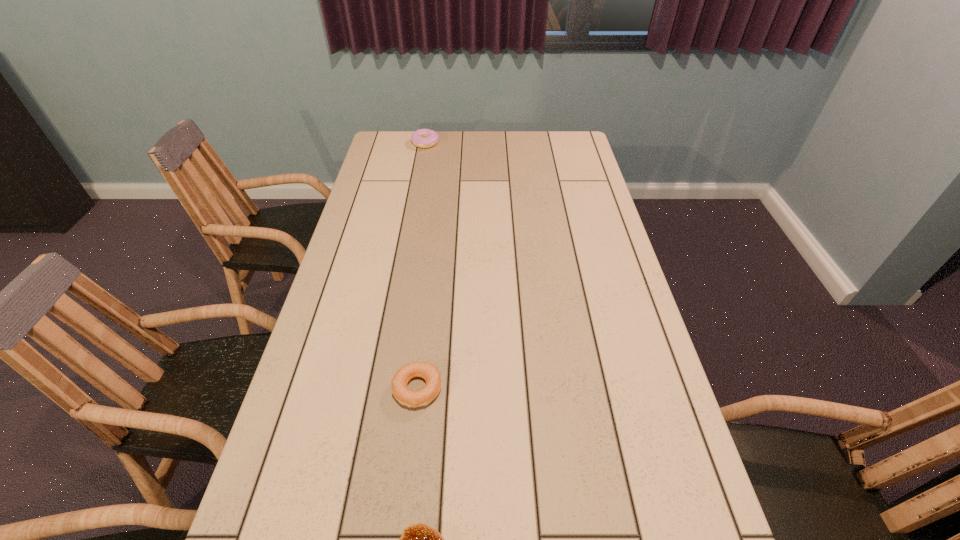
The height and width of the screenshot is (540, 960). I want to click on the farthest object, so click(423, 138).

Find the location of a particular element. the farther bagel is located at coordinates (422, 397).

Locate an element on the screen. Image resolution: width=960 pixels, height=540 pixels. free space located 0.220m on the front of the doughnut is located at coordinates (419, 180).

Find the location of a particular element. free spot located 0.110m on the back of the second nearest object is located at coordinates (423, 332).

Image resolution: width=960 pixels, height=540 pixels. I want to click on object present at the far edge, so click(423, 138).

This screenshot has height=540, width=960. Find the location of `object that is at the left edge`. object that is at the left edge is located at coordinates (423, 138).

Where is `object situated at the far left corner`? This screenshot has width=960, height=540. object situated at the far left corner is located at coordinates (423, 138).

The height and width of the screenshot is (540, 960). In the image, there is a desktop. Identify the location of vacant space at the far edge. (473, 140).

This screenshot has width=960, height=540. In order to click on free spot at the left edge of the desktop in this screenshot , I will do `click(317, 504)`.

In the image, there is a desktop. At what (x,y) coordinates should I click in order to perform the action: click on free space at the right edge. Please return your answer as a coordinate pair (x, y). This screenshot has height=540, width=960. Looking at the image, I should click on (594, 214).